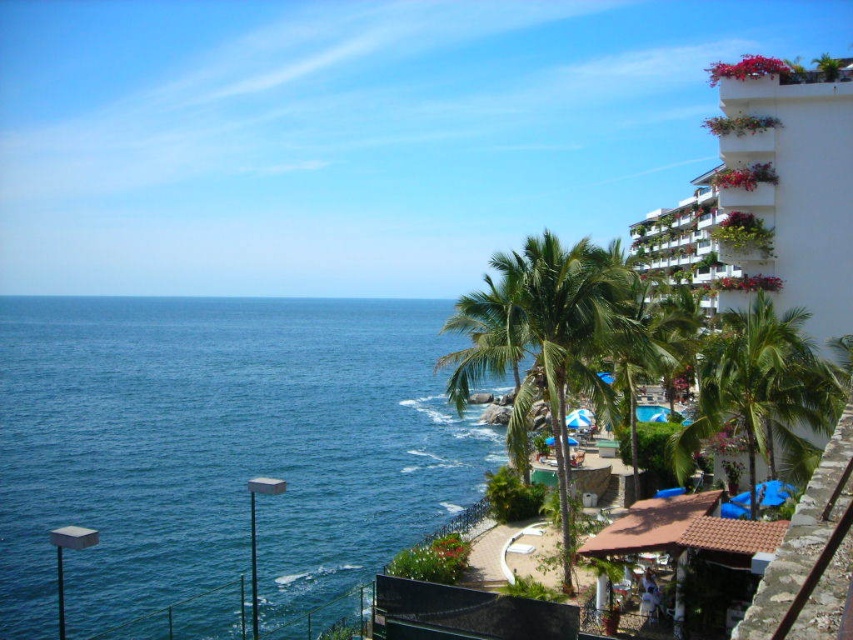
You are standing on the beach and want to take a photo of both the white glossy building at upper right and the green leafy palm tree at center. Which object should you frame first in your camera to ensure both fit in the shot?

The white glossy building at upper right is wider than the green leafy palm tree at center, so you should frame the white glossy building at upper right first to ensure both fit in the shot.

You are a guest staying at the resort and want to take a photo of the white glossy building at upper right while standing on the beach. Since you want the blue water at left to be in the background, should you position yourself facing towards or away from the building?

You should position yourself facing away from the white glossy building at upper right. This way, the blue water at left, which is located below the building, will naturally become the background in your photo.